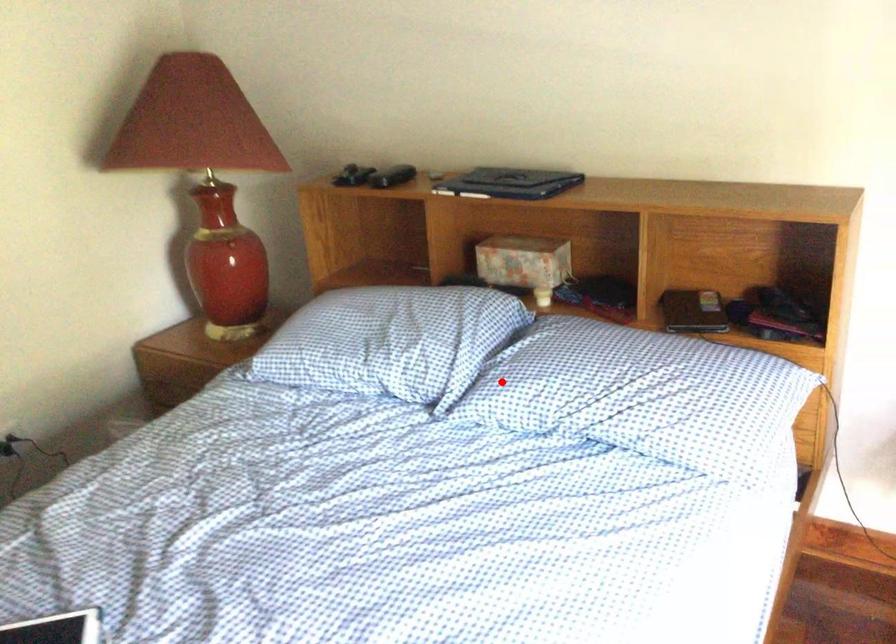
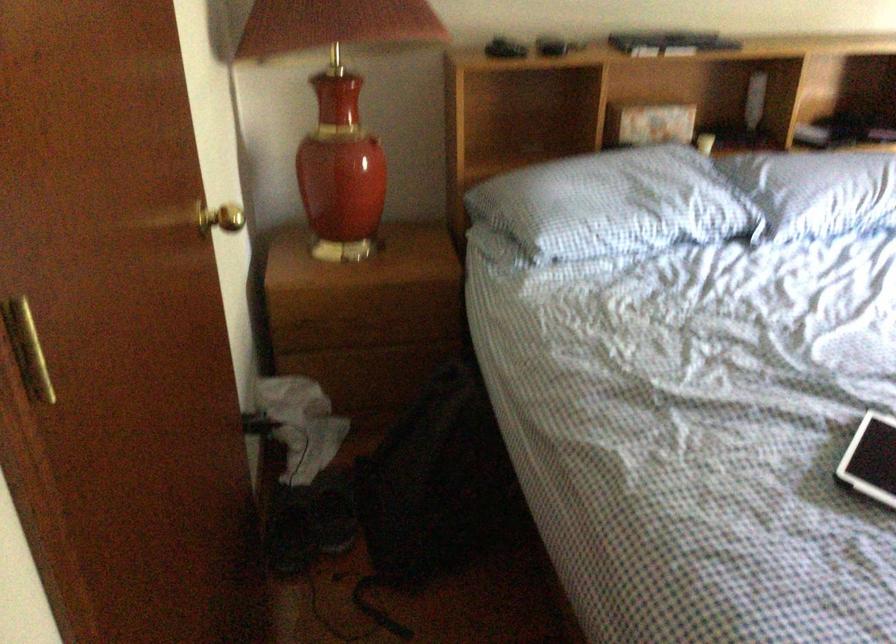
Question: A red point is marked in image1. In image2, is the corresponding 3D point closer to the camera or farther? Reply with the corresponding letter.

Choices:
 (A) The corresponding 3D point is closer.
 (B) The corresponding 3D point is farther.

Answer: (B)